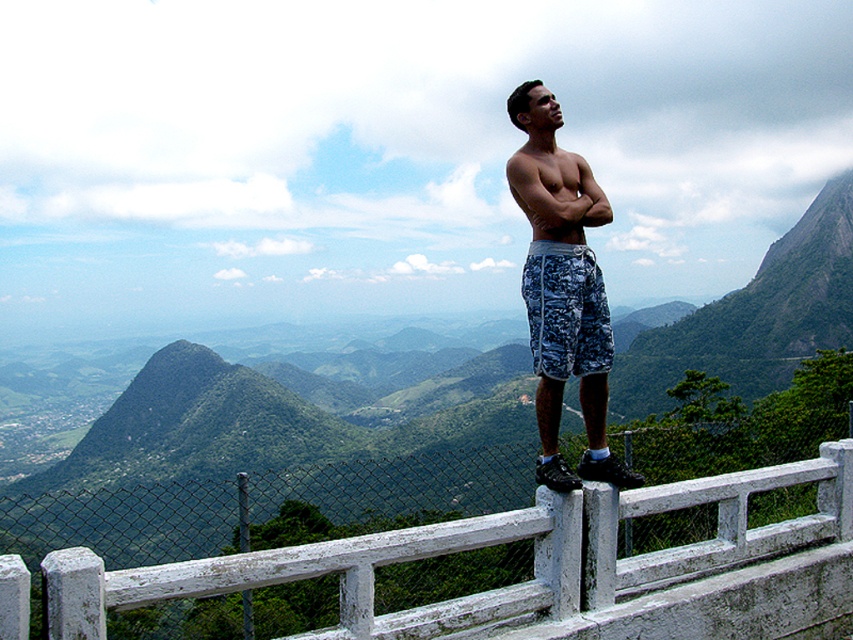
Question: Which of the following is the farthest from the observer?

Choices:
 (A) muscular tan skin at upper center
 (B) white concrete fence at upper center
 (C) camouflage shorts at center
 (D) camouflage fabric shorts at center

Answer: (B)

Question: Can you confirm if camouflage fabric shorts at center is smaller than muscular tan skin at upper center?

Choices:
 (A) yes
 (B) no

Answer: (A)

Question: Does camouflage shorts at center have a larger size compared to camouflage fabric shorts at center?

Choices:
 (A) no
 (B) yes

Answer: (B)

Question: Which of the following is the farthest from the observer?

Choices:
 (A) white concrete fence at upper center
 (B) muscular tan skin at upper center
 (C) camouflage fabric shorts at center

Answer: (A)

Question: Among these objects, which one is nearest to the camera?

Choices:
 (A) camouflage shorts at center
 (B) camouflage fabric shorts at center
 (C) white concrete fence at upper center

Answer: (A)

Question: Can you confirm if white concrete fence at upper center is positioned to the right of camouflage shorts at center?

Choices:
 (A) yes
 (B) no

Answer: (A)